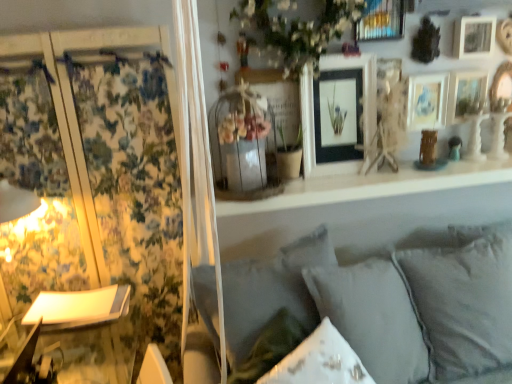
I want to click on vacant region above white matte shelf at upper center (from a real-world perspective), so click(391, 172).